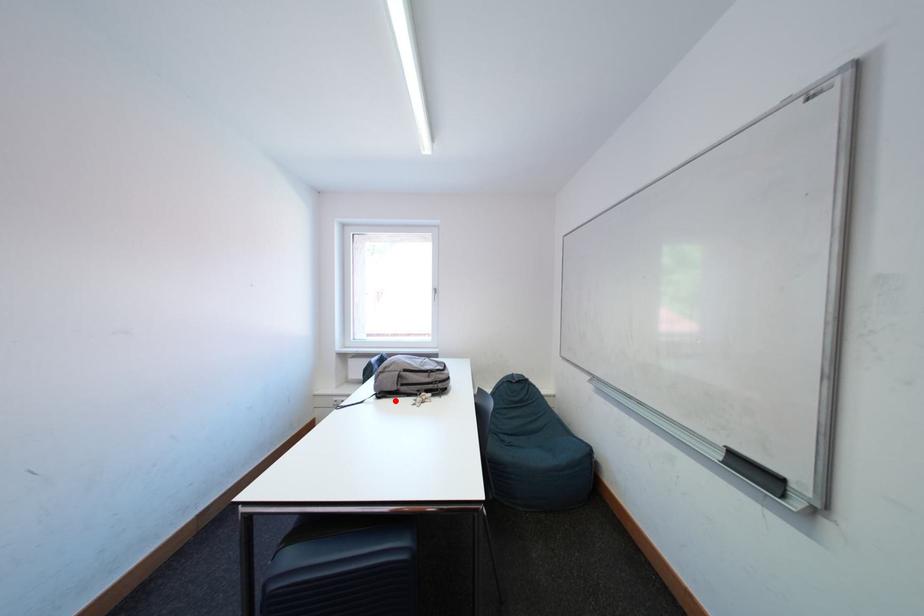
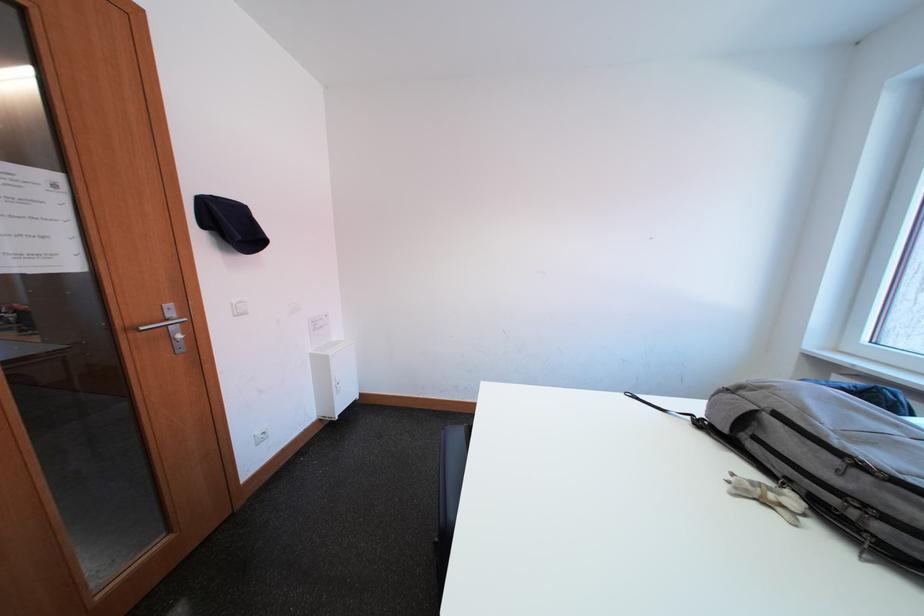
Find the pixel in the second image that matches the highlighted location in the first image.

(719, 438)